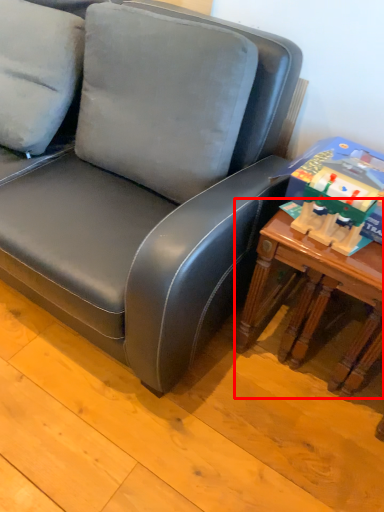
Question: From the image's perspective, where is table (annotated by the red box) located relative to toy?

Choices:
 (A) below
 (B) above

Answer: (A)